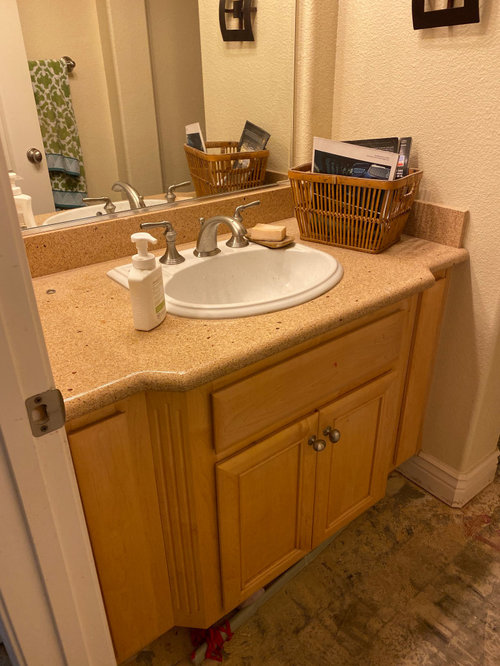
At what (x,y) coordinates should I click in order to perform the action: click on door seal. Please return your answer as a coordinate pair (x, y). Looking at the image, I should click on pos(5,631).